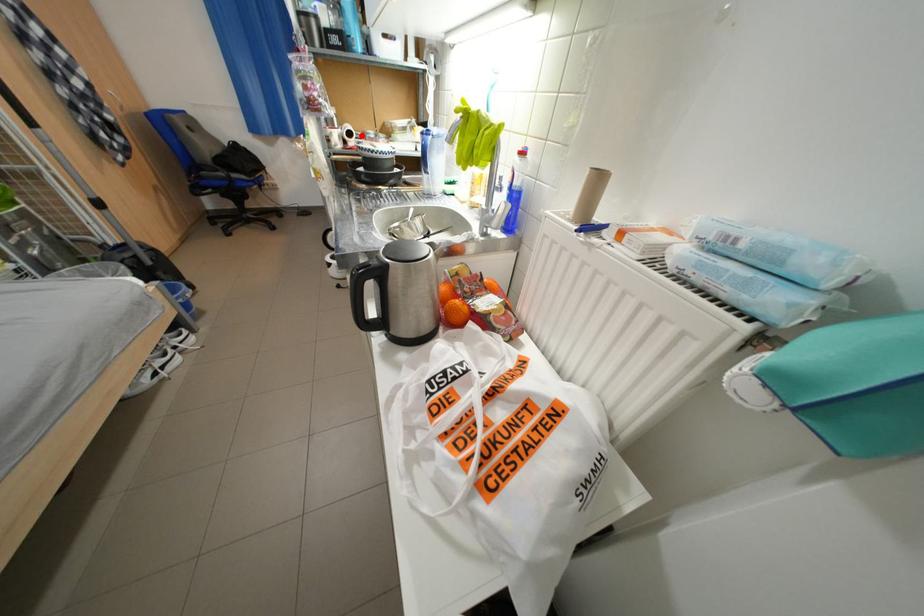
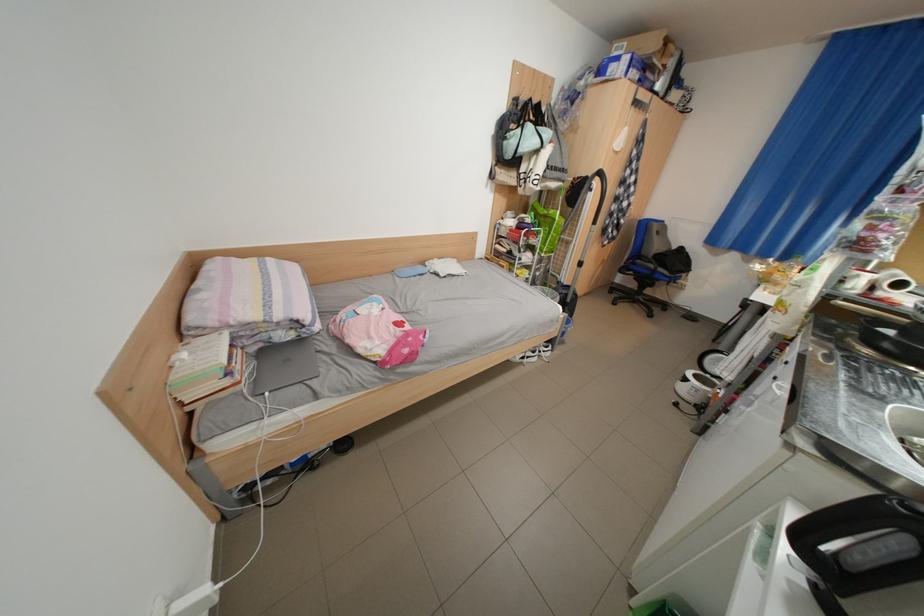
The point at the highlighted location is marked in the first image. Where is the corresponding point in the second image?

(912, 286)